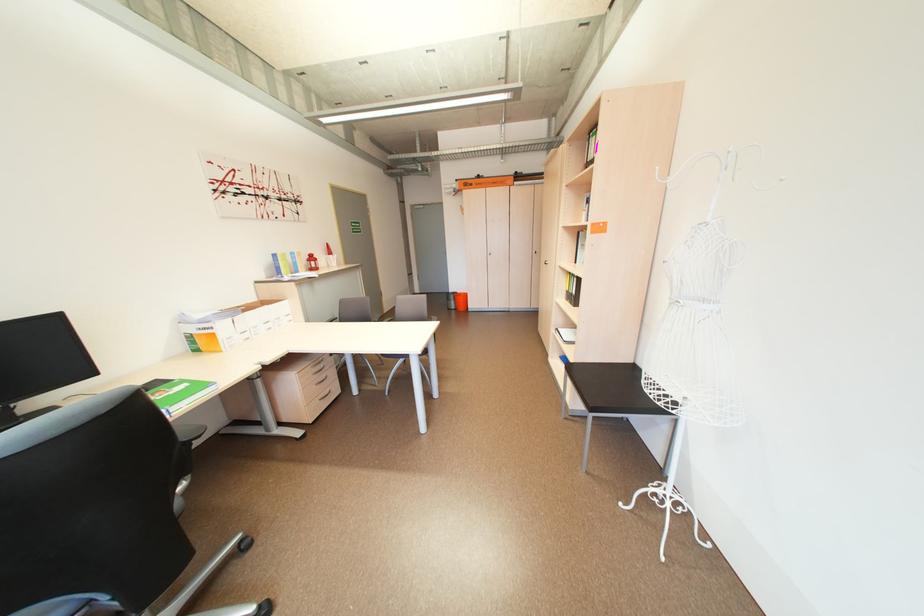
Locate an element on the screen. chair sitting surface is located at coordinates (402, 355).